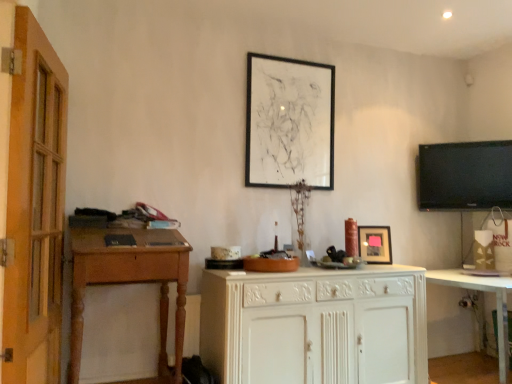
Identify the location of free point above black matte picture frame at upper center, which is the 2th picture frame from bottom to top (from a real-world perspective). This screenshot has width=512, height=384. (292, 61).